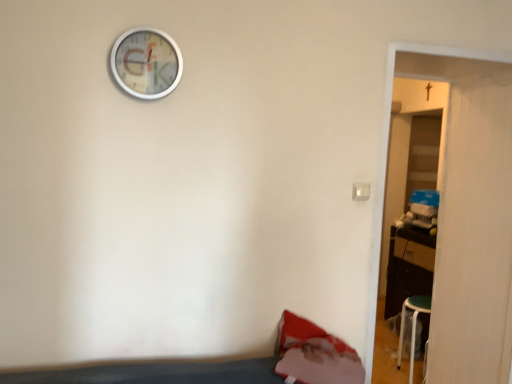
Question: Is wooden door at right closer to the viewer compared to metallic silver wall clock at upper center?

Choices:
 (A) yes
 (B) no

Answer: (B)

Question: Is wooden door at right to the right of metallic silver wall clock at upper center from the viewer's perspective?

Choices:
 (A) no
 (B) yes

Answer: (B)

Question: Could you tell me if wooden door at right is facing metallic silver wall clock at upper center?

Choices:
 (A) no
 (B) yes

Answer: (A)

Question: Considering the relative sizes of wooden door at right and metallic silver wall clock at upper center in the image provided, is wooden door at right smaller than metallic silver wall clock at upper center?

Choices:
 (A) no
 (B) yes

Answer: (A)

Question: From a real-world perspective, is wooden door at right positioned over metallic silver wall clock at upper center based on gravity?

Choices:
 (A) no
 (B) yes

Answer: (A)

Question: Does wooden door at right have a lesser width compared to metallic silver wall clock at upper center?

Choices:
 (A) no
 (B) yes

Answer: (A)

Question: From a real-world perspective, is metallic silver wall clock at upper center located higher than wooden door at right?

Choices:
 (A) yes
 (B) no

Answer: (A)

Question: Is metallic silver wall clock at upper center outside wooden door at right?

Choices:
 (A) no
 (B) yes

Answer: (B)

Question: Can you confirm if metallic silver wall clock at upper center is positioned to the right of wooden door at right?

Choices:
 (A) yes
 (B) no

Answer: (B)

Question: From the image's perspective, is metallic silver wall clock at upper center located beneath wooden door at right?

Choices:
 (A) no
 (B) yes

Answer: (A)

Question: From a real-world perspective, is metallic silver wall clock at upper center beneath wooden door at right?

Choices:
 (A) yes
 (B) no

Answer: (B)

Question: Would you say wooden door at right is part of metallic silver wall clock at upper center's contents?

Choices:
 (A) yes
 (B) no

Answer: (B)

Question: Is metallic silver wall clock at upper center wider or thinner than wooden door at right?

Choices:
 (A) thin
 (B) wide

Answer: (A)